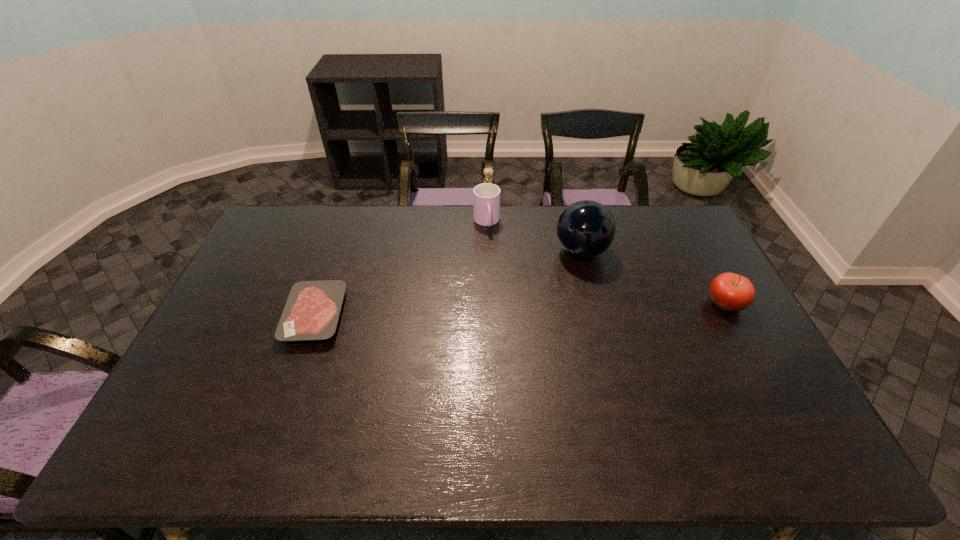
Where is `the shortest object`? This screenshot has height=540, width=960. the shortest object is located at coordinates (312, 309).

I want to click on steak, so [x=312, y=309].

Identify the location of the rightmost object. (730, 292).

Where is `the second object from left to right`? the second object from left to right is located at coordinates (486, 197).

This screenshot has height=540, width=960. In order to click on bowling ball in this screenshot , I will do `click(585, 229)`.

This screenshot has width=960, height=540. What are the coordinates of `the tallest object` in the screenshot? It's located at (585, 229).

Locate an element on the screen. The image size is (960, 540). free space located 0.270m on the right of the shortest object is located at coordinates (434, 315).

I want to click on free location located 0.210m on the left of the apple, so click(638, 304).

In order to click on vacant area situated 0.080m with the handle on the side of the third object from right to left in this screenshot , I will do `click(491, 248)`.

Find the location of a particular element. Image resolution: width=960 pixels, height=540 pixels. vacant space located 0.090m with the handle on the side of the third object from right to left is located at coordinates (492, 250).